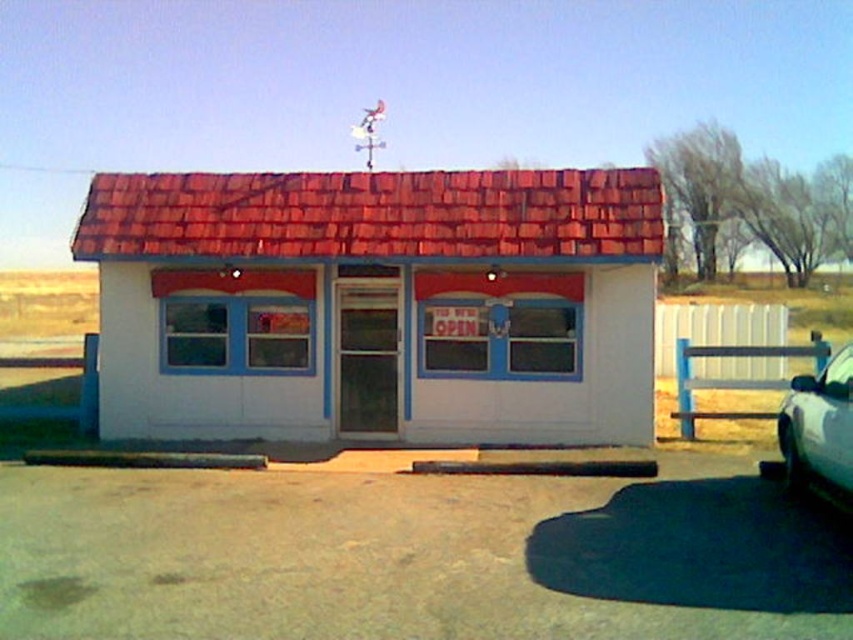
Question: Can you confirm if white painted wood shed at center is positioned above silver metallic car at lower right?

Choices:
 (A) no
 (B) yes

Answer: (B)

Question: Does white painted wood shed at center come behind silver metallic car at lower right?

Choices:
 (A) no
 (B) yes

Answer: (B)

Question: Is white painted wood shed at center smaller than silver metallic car at lower right?

Choices:
 (A) no
 (B) yes

Answer: (B)

Question: Among these objects, which one is farthest from the camera?

Choices:
 (A) silver metallic car at lower right
 (B) white painted wood shed at center

Answer: (B)